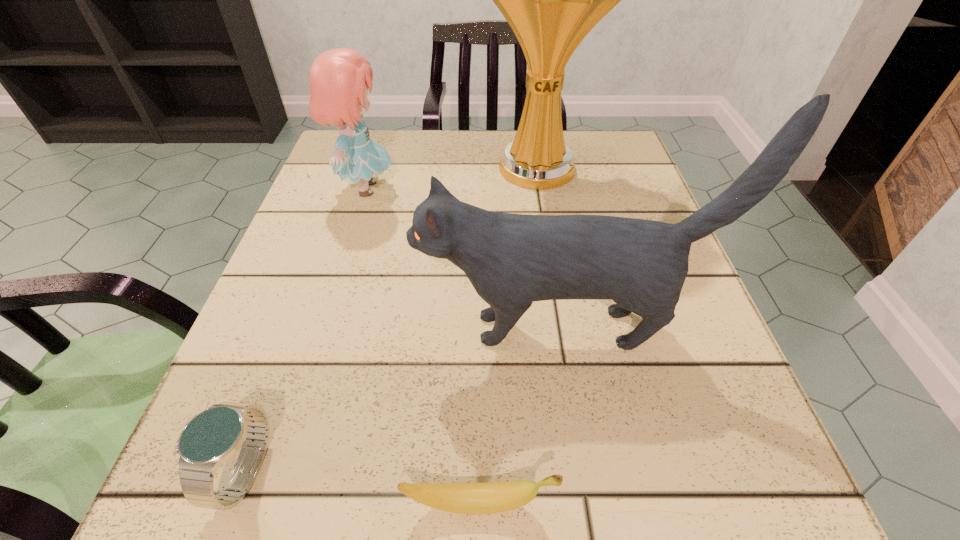
Identify the location of free region located on the front-facing side of the doll. The image size is (960, 540). (570, 188).

Find the location of `vacant space located on the right of the fourth tallest object`. vacant space located on the right of the fourth tallest object is located at coordinates (434, 471).

At what (x,y) coordinates should I click in order to perform the action: click on free location located 0.050m at the stem of the shortest object. Please return your answer as a coordinate pair (x, y). Looking at the image, I should click on (598, 503).

The width and height of the screenshot is (960, 540). Find the location of `trophy_cup at the far edge`. trophy_cup at the far edge is located at coordinates (551, 0).

Locate an element on the screen. This screenshot has height=540, width=960. doll present at the far edge is located at coordinates 340,78.

Locate an element on the screen. watch at the near edge is located at coordinates (210, 438).

Find the location of a particular element. banana that is at the near edge is located at coordinates (464, 498).

Where is `doll present at the left edge`? Image resolution: width=960 pixels, height=540 pixels. doll present at the left edge is located at coordinates (340, 78).

You are a GUI agent. You are given a task and a screenshot of the screen. Output one action in this format:
    pyautogui.click(x=<x>, y=<y>)
    Task: Click on the watch present at the left edge
    Image resolution: width=960 pixels, height=540 pixels.
    Given the screenshot: What is the action you would take?
    pyautogui.click(x=210, y=438)

The width and height of the screenshot is (960, 540). What are the coordinates of `trophy_cup that is positioned at the right edge` in the screenshot? It's located at (551, 0).